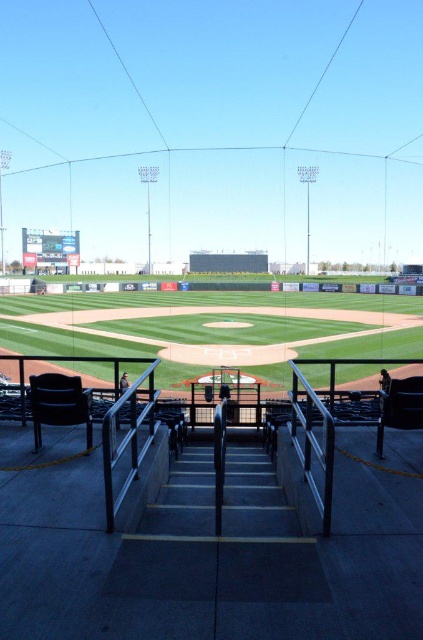
Question: Which point is farther from the camera taking this photo?

Choices:
 (A) (82, 344)
 (B) (121, 392)

Answer: (A)

Question: Does green grass baseball field at center appear over dark gray concrete stairs at center?

Choices:
 (A) yes
 (B) no

Answer: (A)

Question: Does green grass baseball field at center have a lesser width compared to dark blue jersey at center?

Choices:
 (A) no
 (B) yes

Answer: (A)

Question: Which object is closer to the camera taking this photo?

Choices:
 (A) green grass baseball field at center
 (B) dark blue jersey at center
 (C) dark gray concrete stairs at center

Answer: (C)

Question: Does dark gray concrete stairs at center appear on the left side of dark blue jersey at center?

Choices:
 (A) no
 (B) yes

Answer: (A)

Question: Which point is farther to the camera?

Choices:
 (A) dark gray concrete stairs at center
 (B) dark blue jersey at center

Answer: (B)